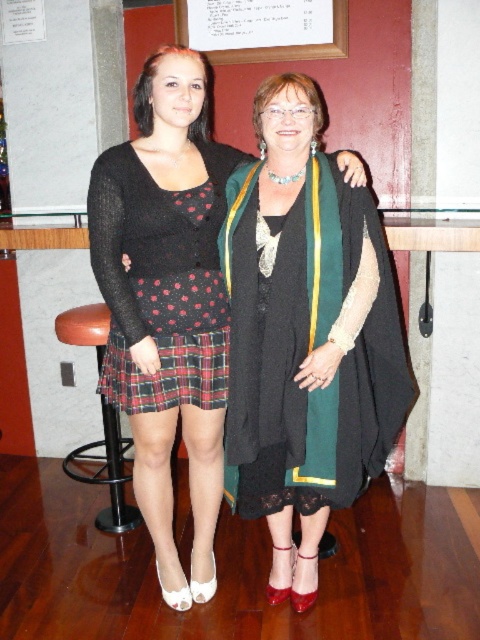
Question: In this image, where is matte black sweater at center located relative to black lace dress at center?

Choices:
 (A) above
 (B) below

Answer: (A)

Question: Which point is farther to the camera?

Choices:
 (A) (317, 244)
 (B) (176, 355)
 (C) (216, 32)
 (D) (168, 54)

Answer: (C)

Question: Which of the following is the closest to the observer?

Choices:
 (A) white paper at upper center
 (B) plaid fabric skirt at lower center
 (C) brown leather stool at lower left

Answer: (B)

Question: Where is matte black sweater at center located in relation to black lace dress at center in the image?

Choices:
 (A) right
 (B) left

Answer: (B)

Question: Does matte black sweater at center appear on the left side of black lace dress at center?

Choices:
 (A) yes
 (B) no

Answer: (A)

Question: Based on their relative distances, which object is farther from the white paper at upper center?

Choices:
 (A) brown leather stool at lower left
 (B) matte black sweater at center
 (C) black lace dress at center

Answer: (A)